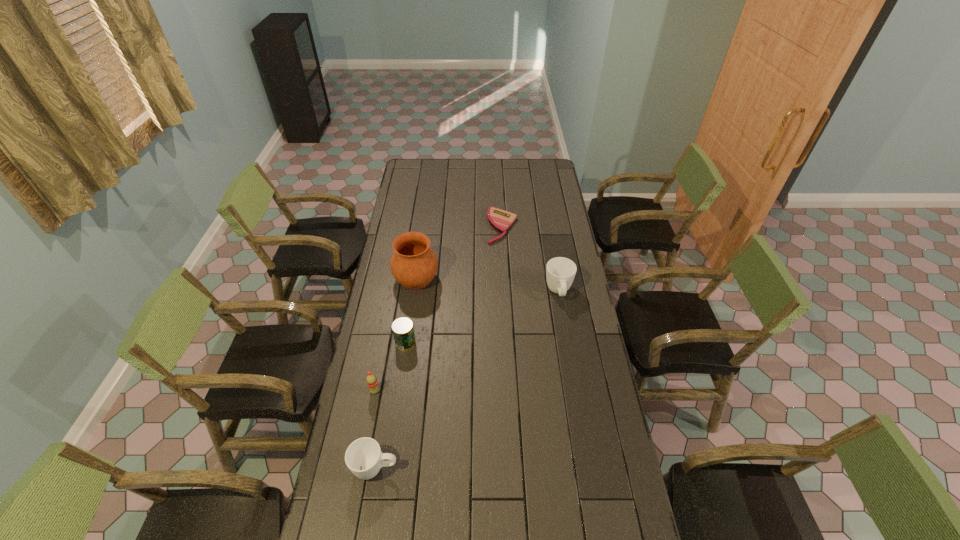
At what (x,y) coordinates should I click in order to perform the action: click on spot to insert another cup for uniform distribution. Please return your answer as a coordinate pair (x, y). This screenshot has height=540, width=960. Looking at the image, I should click on (482, 366).